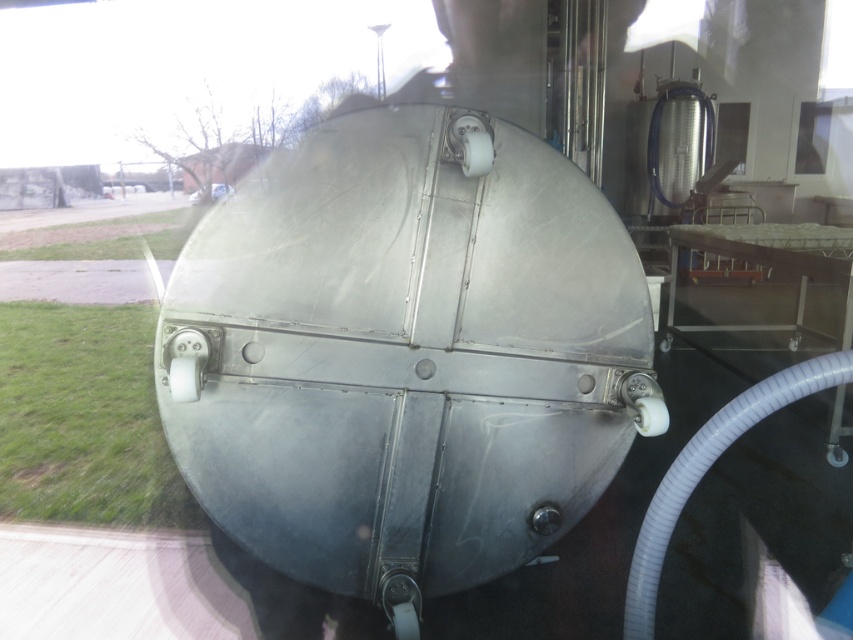
Between metallic silver tray at center and clear glass window at upper right, which one appears on the left side from the viewer's perspective?

Positioned to the left is metallic silver tray at center.

Can you confirm if metallic silver tray at center is positioned below clear glass window at upper right?

Yes.

Does point (668, 236) come in front of point (715, 161)?

Yes, point (668, 236) is closer to viewer.

Locate an element on the screen. The width and height of the screenshot is (853, 640). metallic silver tray at center is located at coordinates (769, 266).

Does transparent glass window at upper right appear on the right side of clear glass window at upper right?

Yes, transparent glass window at upper right is to the right of clear glass window at upper right.

From the picture: Does transparent glass window at upper right have a lesser height compared to clear glass window at upper right?

No.

Is point (807, 150) farther from viewer compared to point (730, 154)?

That is True.

The image size is (853, 640). I want to click on transparent glass window at upper right, so click(x=811, y=138).

Is the position of polished metallic tank at center less distant than that of metallic silver tray at center?

Yes, it is.

Who is more forward, (x=509, y=436) or (x=846, y=317)?

Point (x=509, y=436)

Where is `polished metallic tank at center`? This screenshot has height=640, width=853. polished metallic tank at center is located at coordinates (405, 356).